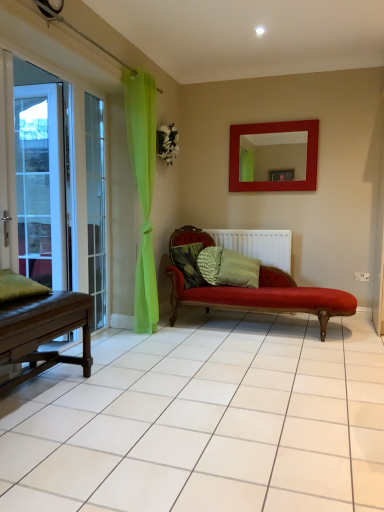
Question: Considering the relative sizes of textured green pillow at center, which is the fourth pillow from front to back, and green fabric pillow at left, marked as the first pillow in a left-to-right arrangement, in the image provided, is textured green pillow at center, which is the fourth pillow from front to back, smaller than green fabric pillow at left, marked as the first pillow in a left-to-right arrangement,?

Choices:
 (A) yes
 (B) no

Answer: (A)

Question: From a real-world perspective, is textured green pillow at center, which is the 1th pillow from back to front, physically above green fabric pillow at left, marked as the first pillow in a left-to-right arrangement?

Choices:
 (A) yes
 (B) no

Answer: (B)

Question: Is textured green pillow at center, which is the 1th pillow from back to front, looking in the opposite direction of green fabric pillow at left, placed as the first pillow when sorted from front to back?

Choices:
 (A) yes
 (B) no

Answer: (B)

Question: Does textured green pillow at center, arranged as the 3th pillow when viewed from the left, lie in front of green fabric pillow at left, placed as the fourth pillow when sorted from back to front?

Choices:
 (A) no
 (B) yes

Answer: (A)

Question: Does textured green pillow at center, placed as the second pillow when sorted from right to left, have a larger size compared to green fabric pillow at left, placed as the fourth pillow when sorted from back to front?

Choices:
 (A) yes
 (B) no

Answer: (B)

Question: From the image's perspective, is textured green pillow at center, placed as the second pillow when sorted from right to left, above or below matte red mirror at upper center?

Choices:
 (A) below
 (B) above

Answer: (A)

Question: Considering the relative positions of textured green pillow at center, arranged as the 3th pillow when viewed from the left, and matte red mirror at upper center in the image provided, is textured green pillow at center, arranged as the 3th pillow when viewed from the left, to the left or to the right of matte red mirror at upper center?

Choices:
 (A) right
 (B) left

Answer: (B)

Question: Is textured green pillow at center, which is the 1th pillow from back to front, bigger or smaller than matte red mirror at upper center?

Choices:
 (A) big
 (B) small

Answer: (B)

Question: From a real-world perspective, relative to matte red mirror at upper center, is textured green pillow at center, arranged as the 3th pillow when viewed from the left, vertically above or below?

Choices:
 (A) below
 (B) above

Answer: (A)

Question: From the image's perspective, is clear glass door at left located above or below textured green pillow at center, arranged as the 3th pillow when viewed from the left?

Choices:
 (A) above
 (B) below

Answer: (A)

Question: Would you say clear glass door at left is to the left or to the right of textured green pillow at center, which is the 1th pillow from back to front, in the picture?

Choices:
 (A) left
 (B) right

Answer: (A)

Question: Considering the positions of point (104, 254) and point (218, 247), is point (104, 254) closer or farther from the camera than point (218, 247)?

Choices:
 (A) farther
 (B) closer

Answer: (B)

Question: From a real-world perspective, relative to textured green pillow at center, arranged as the 3th pillow when viewed from the left, is clear glass door at left vertically above or below?

Choices:
 (A) above
 (B) below

Answer: (A)

Question: Is textured green pillow at center, placed as the 3th pillow when sorted from right to left, bigger or smaller than green fabric pillow at left, placed as the first pillow when sorted from front to back?

Choices:
 (A) big
 (B) small

Answer: (A)

Question: In the image, is textured green pillow at center, the 2th pillow positioned from the front, on the left side or the right side of green fabric pillow at left, placed as the fourth pillow when sorted from back to front?

Choices:
 (A) left
 (B) right

Answer: (B)